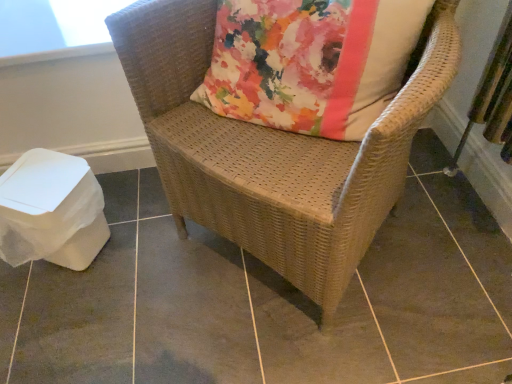
Locate an element on the screen. The image size is (512, 384). vacant area on top of brown woven chair at center (from a real-world perspective) is located at coordinates (254, 289).